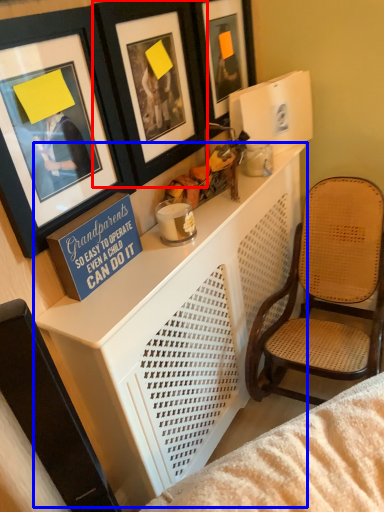
Question: Which object is closer to the camera taking this photo, picture frame (highlighted by a red box) or table (highlighted by a blue box)?

Choices:
 (A) picture frame
 (B) table

Answer: (B)